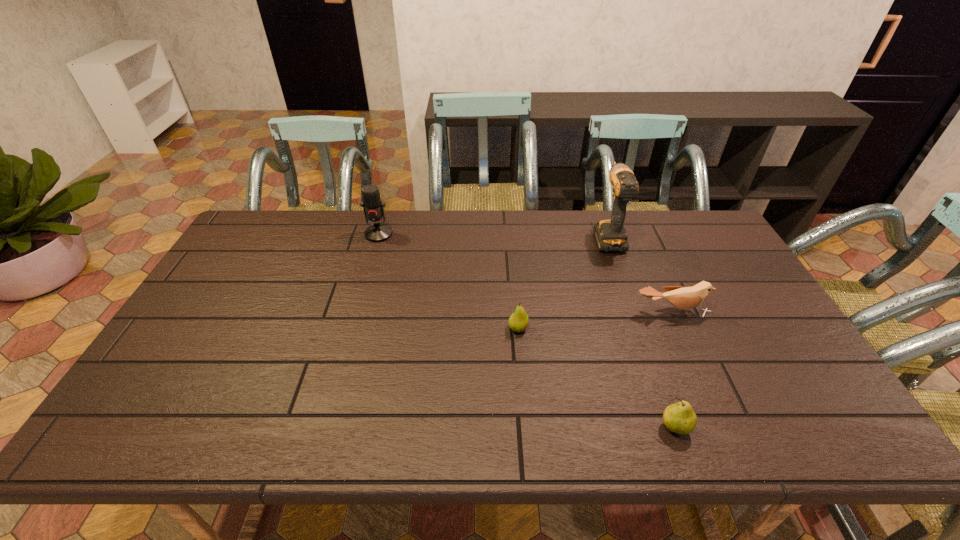
Locate an element on the screen. The height and width of the screenshot is (540, 960). free spot between the farther pear and the drill is located at coordinates (563, 282).

The width and height of the screenshot is (960, 540). Find the location of `object that stands as the closest to the left pear`. object that stands as the closest to the left pear is located at coordinates pyautogui.click(x=683, y=298).

Find the location of a particular element. The width and height of the screenshot is (960, 540). object that stands as the second closest to the nearer pear is located at coordinates (518, 321).

Image resolution: width=960 pixels, height=540 pixels. In order to click on free space that satisfies the following two spatial constraints: 1. on the side of the right pear with the red ring; 2. on the left side of the fourth shortest object in this screenshot , I will do `click(324, 428)`.

Locate an element on the screen. vacant area that satisfies the following two spatial constraints: 1. on the side of the farther pear with the red ring; 2. on the right side of the leftmost object is located at coordinates (351, 328).

At what (x,y) coordinates should I click in order to perform the action: click on free spot that satisfies the following two spatial constraints: 1. on the side of the nearer pear with the red ring; 2. on the left side of the second tallest object. Please return your answer as a coordinate pair (x, y). The width and height of the screenshot is (960, 540). Looking at the image, I should click on (324, 428).

You are a GUI agent. You are given a task and a screenshot of the screen. Output one action in this format:
    pyautogui.click(x=<x>, y=<y>)
    Task: Click on the vacant space that satisfies the following two spatial constraints: 1. on the side of the nearest object with the red ring; 2. on the right side of the second tallest object
    
    Given the screenshot: What is the action you would take?
    pyautogui.click(x=324, y=428)